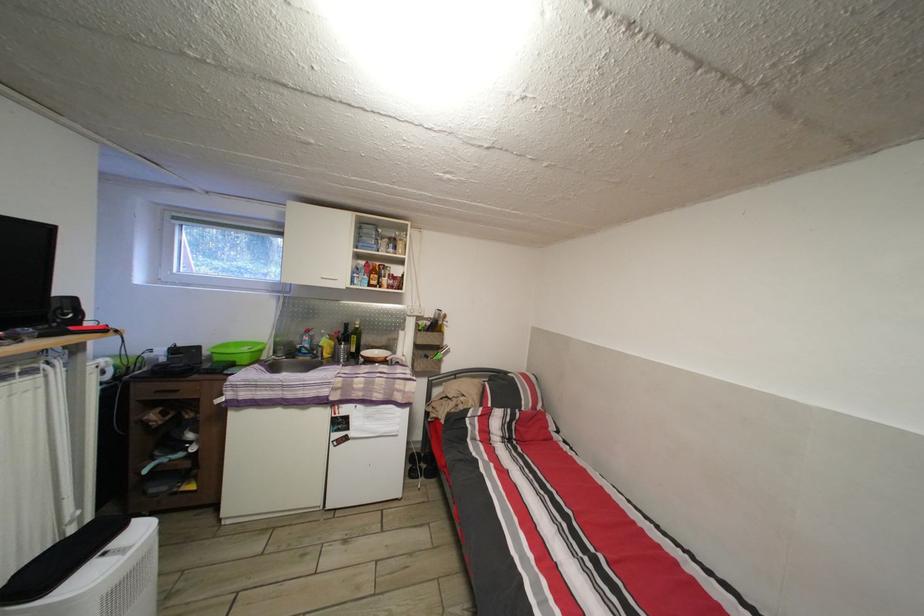
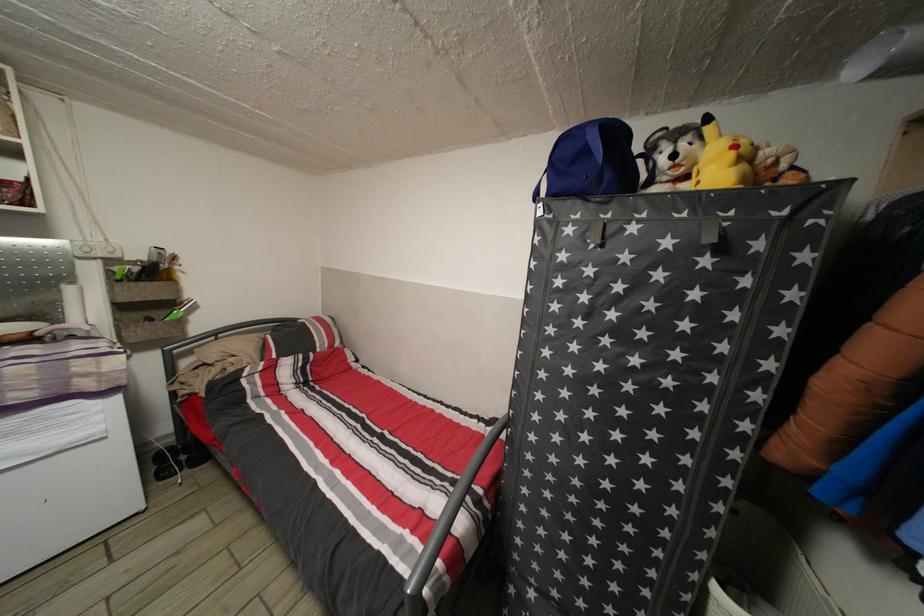
Where in the second image is the point corresponding to (423,353) from the first image?

(128, 314)